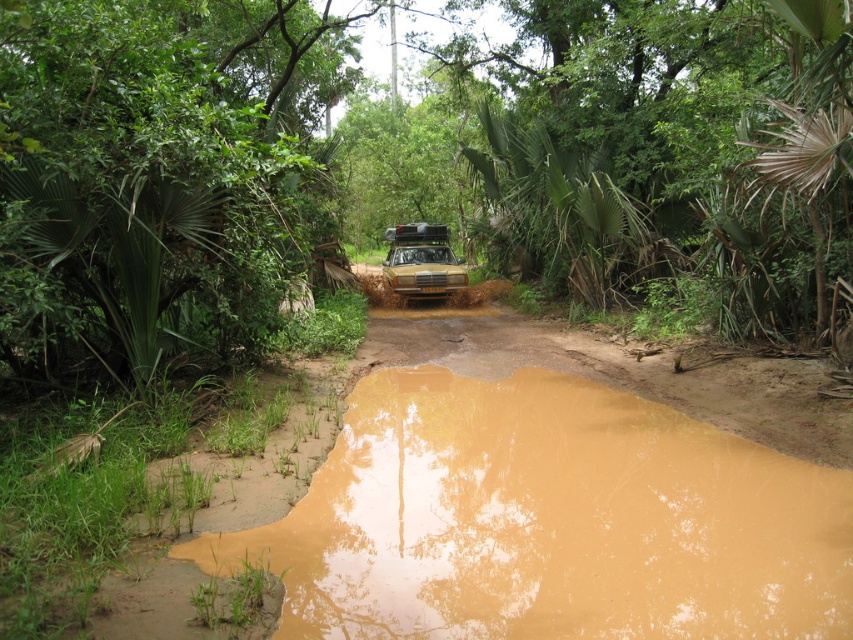
Is brown muddy water at lower center positioned before green leafy bush at upper left?

Yes, brown muddy water at lower center is in front of green leafy bush at upper left.

Can you confirm if brown muddy water at lower center is positioned below green leafy bush at upper left?

Yes, brown muddy water at lower center is below green leafy bush at upper left.

Locate an element on the screen. The image size is (853, 640). brown muddy water at lower center is located at coordinates (549, 522).

Who is positioned more to the right, brown muddy water at lower center or yellow matte car at center?

brown muddy water at lower center

Does point (663, 614) lie in front of point (421, 273)?

Yes, point (663, 614) is closer to viewer.

Find the location of a particular element. The image size is (853, 640). brown muddy water at lower center is located at coordinates point(549,522).

Which is below, green leafy bush at upper left or yellow matte car at center?

yellow matte car at center

This screenshot has height=640, width=853. What do you see at coordinates (140, 182) in the screenshot?
I see `green leafy bush at upper left` at bounding box center [140, 182].

Between point (227, 164) and point (440, 241), which one is positioned behind?

The point (440, 241) is behind.

This screenshot has width=853, height=640. What are the coordinates of `green leafy bush at upper left` in the screenshot? It's located at (140, 182).